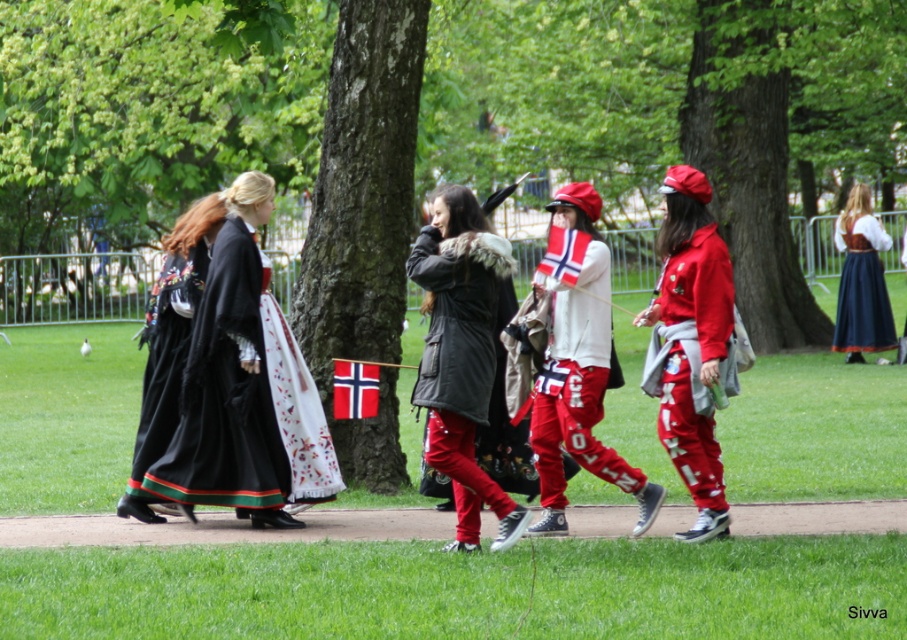
Question: Considering the relative positions of matte white hoodie at center and red fabric flag at center in the image provided, where is matte white hoodie at center located with respect to red fabric flag at center?

Choices:
 (A) left
 (B) right

Answer: (B)

Question: Observing the image, what is the correct spatial positioning of smooth bark tree at center in reference to matte black coat at center?

Choices:
 (A) below
 (B) above

Answer: (B)

Question: Can you confirm if green leafy tree at center is wider than matte black coat at center?

Choices:
 (A) yes
 (B) no

Answer: (A)

Question: Which point appears farthest from the camera in this image?

Choices:
 (A) (366, 376)
 (B) (746, 51)
 (C) (875, 316)

Answer: (B)

Question: Which of the following is the closest to the observer?

Choices:
 (A) matte red tracksuit at center
 (B) matte black dress at center
 (C) matte black coat at center

Answer: (C)

Question: Estimate the real-world distances between objects in this image. Which object is closer to the velvet black dress at left?

Choices:
 (A) matte red tracksuit at center
 (B) matte white hoodie at center
 (C) red fabric flag at center

Answer: (C)